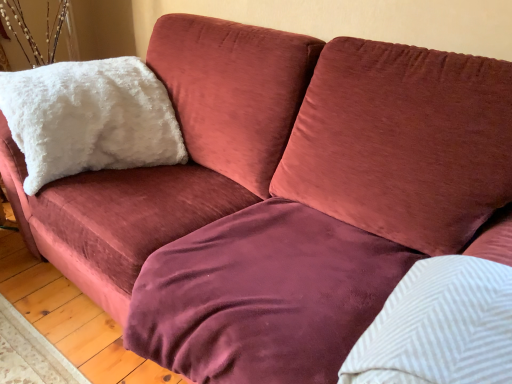
Question: Considering the relative positions of white textured pillow at upper right, positioned as the first pillow in right-to-left order, and velvet maroon blanket at center in the image provided, is white textured pillow at upper right, positioned as the first pillow in right-to-left order, to the left or to the right of velvet maroon blanket at center?

Choices:
 (A) left
 (B) right

Answer: (B)

Question: In terms of width, does white textured pillow at upper right, which is the second pillow from top to bottom, look wider or thinner when compared to velvet maroon blanket at center?

Choices:
 (A) wide
 (B) thin

Answer: (B)

Question: Which is farther from the velvet maroon blanket at center?

Choices:
 (A) white fluffy pillow at upper left, which is counted as the second pillow, starting from the front
 (B) white textured pillow at upper right, which is the second pillow from top to bottom

Answer: (A)

Question: Estimate the real-world distances between objects in this image. Which object is farther from the white fluffy pillow at upper left, arranged as the 1th pillow when viewed from the left?

Choices:
 (A) velvet maroon blanket at center
 (B) white textured pillow at upper right, the second pillow when ordered from left to right

Answer: (B)